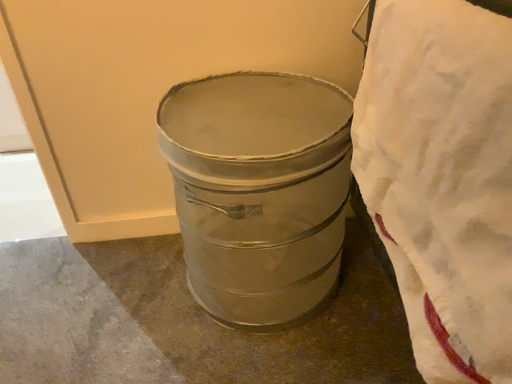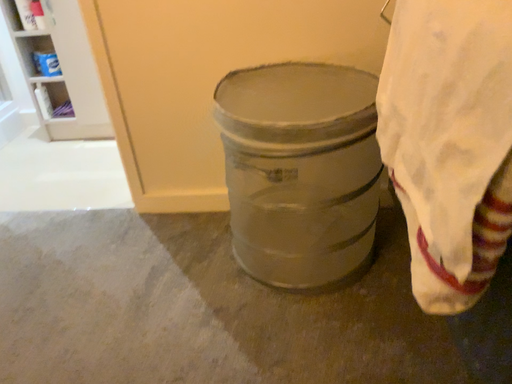
Question: How did the camera likely rotate when shooting the video?

Choices:
 (A) rotated left
 (B) rotated right

Answer: (A)